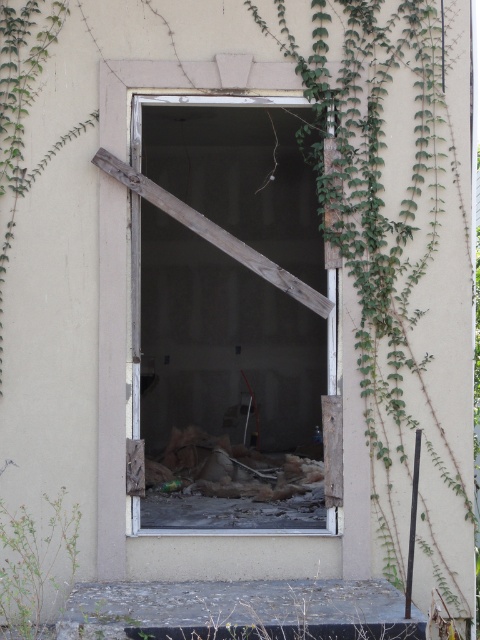
Who is taller, wooden door at center or green leafy plant at lower left?

wooden door at center is taller.

Is wooden door at center positioned before green leafy plant at lower left?

No, wooden door at center is further to the viewer.

The width and height of the screenshot is (480, 640). What do you see at coordinates (226, 388) in the screenshot? I see `wooden door at center` at bounding box center [226, 388].

At what (x,y) coordinates should I click in order to perform the action: click on wooden door at center. Please return your answer as a coordinate pair (x, y). Looking at the image, I should click on (226, 388).